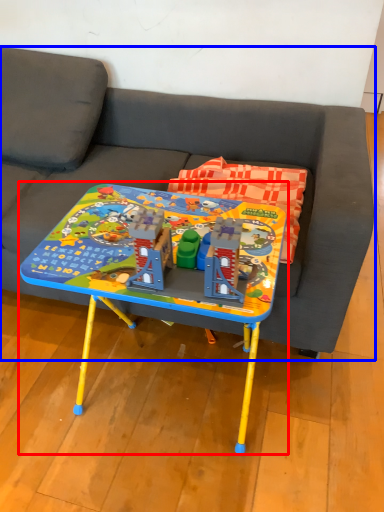
Question: Which point is further to the camera, table (highlighted by a red box) or studio couch (highlighted by a blue box)?

Choices:
 (A) table
 (B) studio couch

Answer: (B)